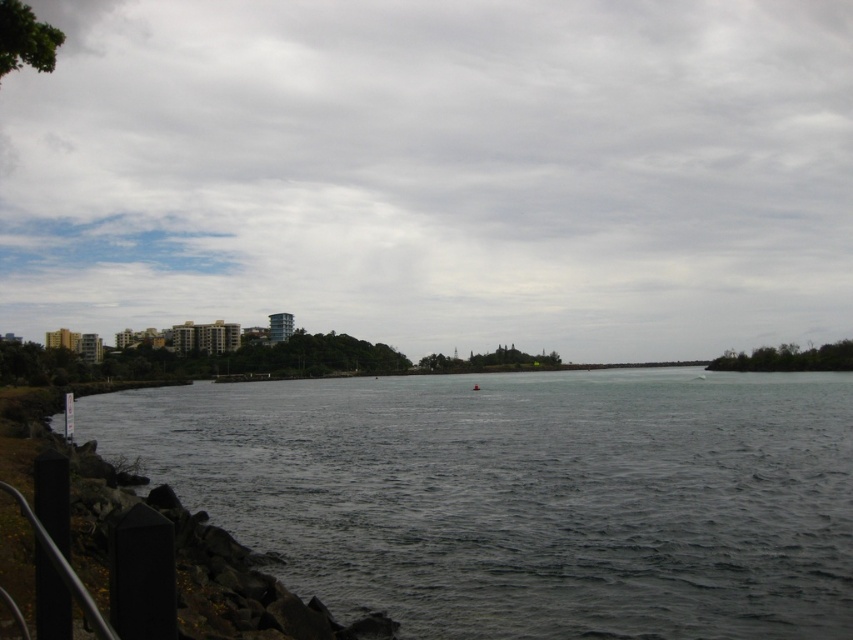
Question: Among these points, which one is nearest to the camera?

Choices:
 (A) (294, 506)
 (B) (625, 129)

Answer: (A)

Question: Is gray cloudy sky at upper center positioned at the back of dark gray water at center?

Choices:
 (A) no
 (B) yes

Answer: (B)

Question: Which point appears closest to the camera in this image?

Choices:
 (A) (827, 456)
 (B) (666, 273)

Answer: (A)

Question: Does gray cloudy sky at upper center appear over dark gray water at center?

Choices:
 (A) yes
 (B) no

Answer: (A)

Question: Does gray cloudy sky at upper center have a larger size compared to dark gray water at center?

Choices:
 (A) no
 (B) yes

Answer: (B)